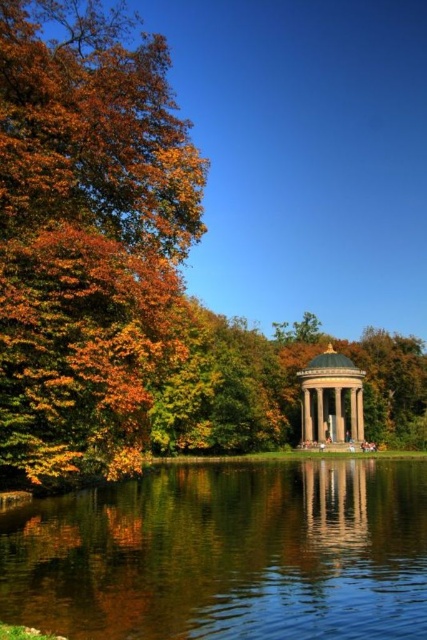
Which of these two, transparent water at center or white marble gazebo at center, stands shorter?

With less height is transparent water at center.

The width and height of the screenshot is (427, 640). Describe the element at coordinates (227, 554) in the screenshot. I see `transparent water at center` at that location.

I want to click on transparent water at center, so click(227, 554).

Is autumn leaves at left shorter than white marble gazebo at center?

In fact, autumn leaves at left may be taller than white marble gazebo at center.

Image resolution: width=427 pixels, height=640 pixels. What do you see at coordinates (85, 236) in the screenshot?
I see `autumn leaves at left` at bounding box center [85, 236].

What do you see at coordinates (85, 236) in the screenshot? I see `autumn leaves at left` at bounding box center [85, 236].

The image size is (427, 640). What are the coordinates of `autumn leaves at left` in the screenshot? It's located at (85, 236).

Does point (108, 192) lie in front of point (160, 579)?

No, it is not.

Find the location of a particular element. This screenshot has height=640, width=427. autumn leaves at left is located at coordinates (85, 236).